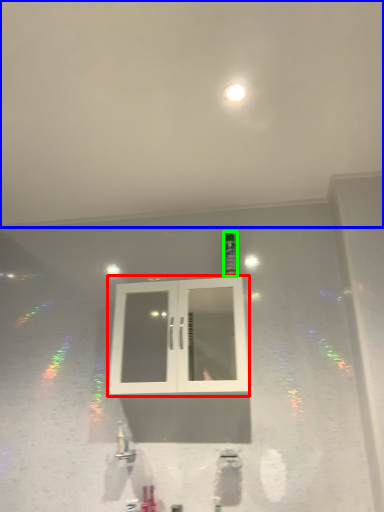
Question: Estimate the real-world distances between objects in this image. Which object is farther from window (highlighted by a red box), backdrop (highlighted by a blue box) or bottle (highlighted by a green box)?

Choices:
 (A) backdrop
 (B) bottle

Answer: (A)